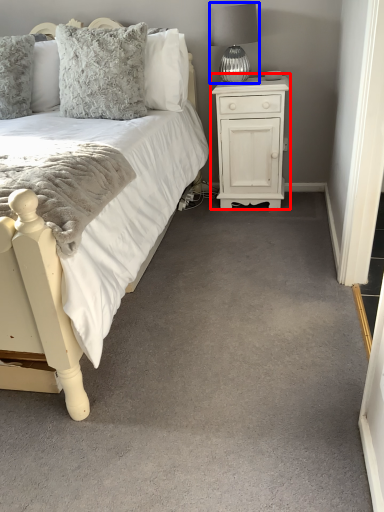
Question: Which object appears farthest to the camera in this image, nightstand (highlighted by a red box) or table lamp (highlighted by a blue box)?

Choices:
 (A) nightstand
 (B) table lamp

Answer: (A)